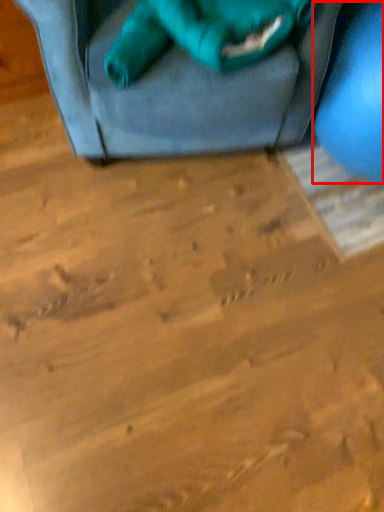
Question: From the image's perspective, where is turquoise (annotated by the red box) located in relation to animal in the image?

Choices:
 (A) below
 (B) above

Answer: (A)